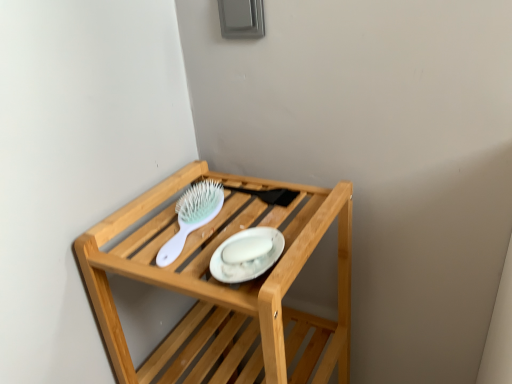
Locate an element on the screen. vacant space behind white plastic brush at upper center is located at coordinates (186, 186).